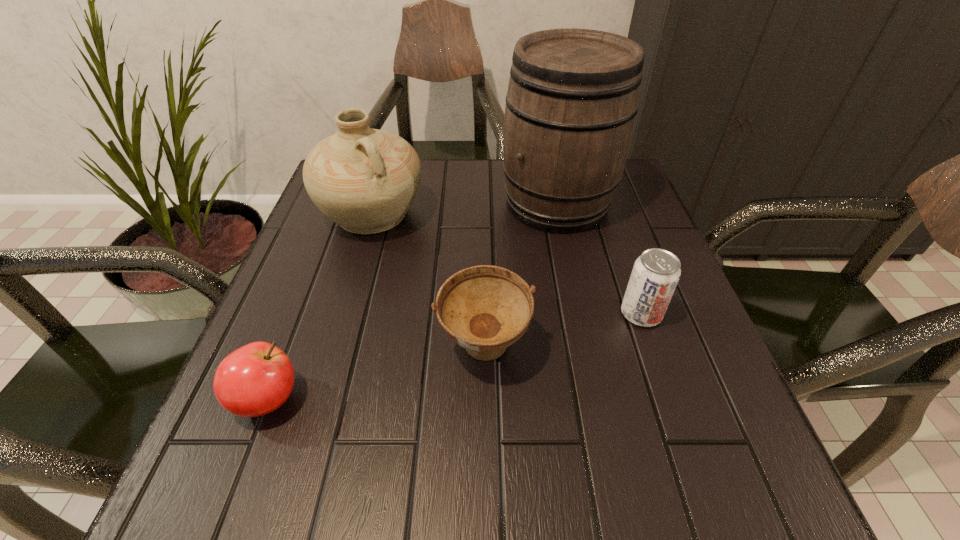
Find the location of `wine bucket that is at the far edge`. wine bucket that is at the far edge is located at coordinates (573, 96).

You are a GUI agent. You are given a task and a screenshot of the screen. Output one action in this format:
    pyautogui.click(x=<x>, y=<y>)
    Task: Click on the pottery at the far edge
    The height and width of the screenshot is (540, 960).
    Given the screenshot: What is the action you would take?
    pos(365,180)

At what (x,y) coordinates should I click in order to perform the action: click on pottery situated at the left edge. Please return your answer as a coordinate pair (x, y). Looking at the image, I should click on (365, 180).

The width and height of the screenshot is (960, 540). Find the location of `apple at the left edge`. apple at the left edge is located at coordinates (256, 379).

Locate an element on the screen. This screenshot has height=540, width=960. wine bucket that is at the right edge is located at coordinates (573, 96).

Where is `soda can that is at the right edge`? Image resolution: width=960 pixels, height=540 pixels. soda can that is at the right edge is located at coordinates click(655, 275).

At what (x,y) coordinates should I click in order to perform the action: click on object present at the far left corner. Please return your answer as a coordinate pair (x, y). This screenshot has width=960, height=540. Looking at the image, I should click on (365, 180).

You are a GUI agent. You are given a task and a screenshot of the screen. Output one action in this format:
    pyautogui.click(x=<x>, y=<y>)
    Task: Click on the object located in the far right corner section of the desktop
    This screenshot has width=960, height=540.
    Given the screenshot: What is the action you would take?
    pyautogui.click(x=573, y=96)

Where is `vacant space at the far edge of the desktop`? vacant space at the far edge of the desktop is located at coordinates (497, 190).

Find the location of a particular element. The width and height of the screenshot is (960, 540). vacant space at the near edge is located at coordinates (319, 510).